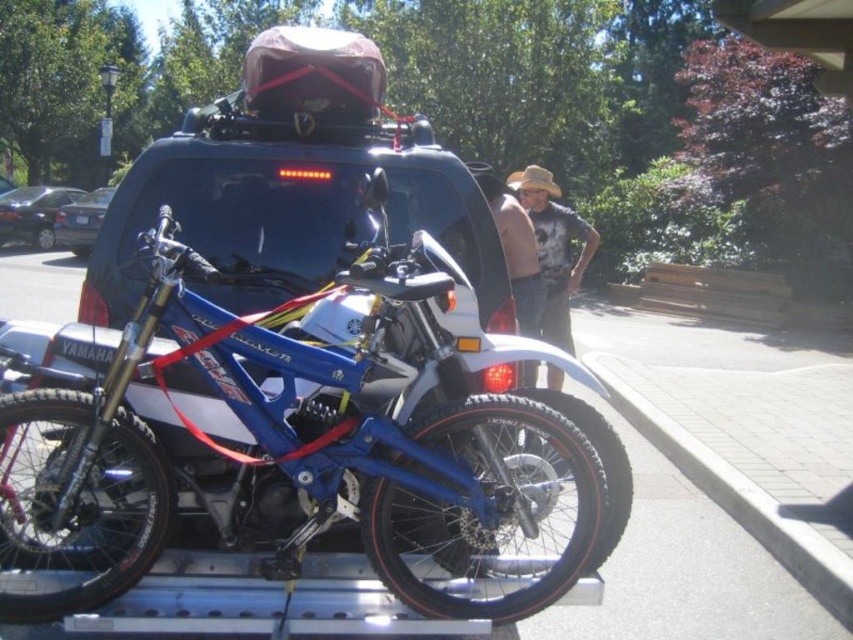
Question: Does blue metallic motorcycle at center appear under shiny black sedan at left?

Choices:
 (A) no
 (B) yes

Answer: (B)

Question: Based on their relative distances, which object is nearer to the denim shirt at center?

Choices:
 (A) matte black car at center
 (B) blue metallic motorcycle at center

Answer: (B)

Question: Can you confirm if denim shirt at center is bigger than shiny black sedan at left?

Choices:
 (A) yes
 (B) no

Answer: (B)

Question: Which object is the closest to the tan straw hat at upper center?

Choices:
 (A) shiny black sedan at left
 (B) matte black car at center

Answer: (B)

Question: Which of the following is the farthest from the observer?

Choices:
 (A) (227, 349)
 (B) (70, 208)
 (C) (527, 381)

Answer: (B)

Question: Is blue metallic motorcycle at center thinner than denim shirt at center?

Choices:
 (A) yes
 (B) no

Answer: (B)